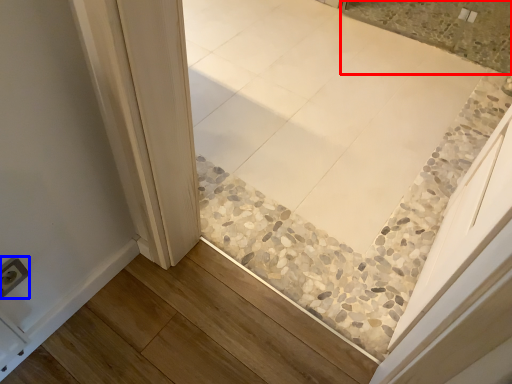
Question: Which of the following is the closest to the observer, tile (highlighted by a red box) or electric outlet (highlighted by a blue box)?

Choices:
 (A) tile
 (B) electric outlet

Answer: (B)